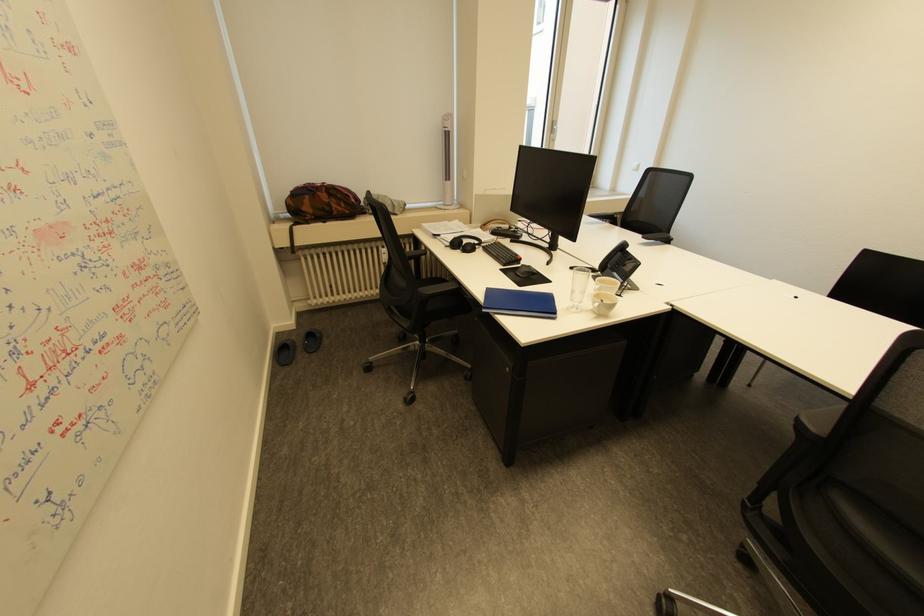
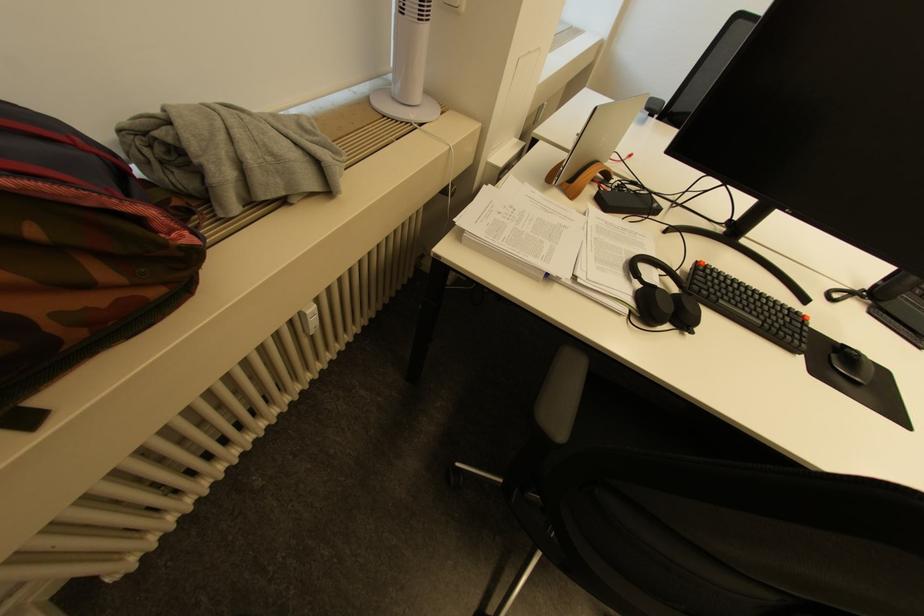
Find the pixel in the second image that matches (442,208) in the first image.

(391, 116)